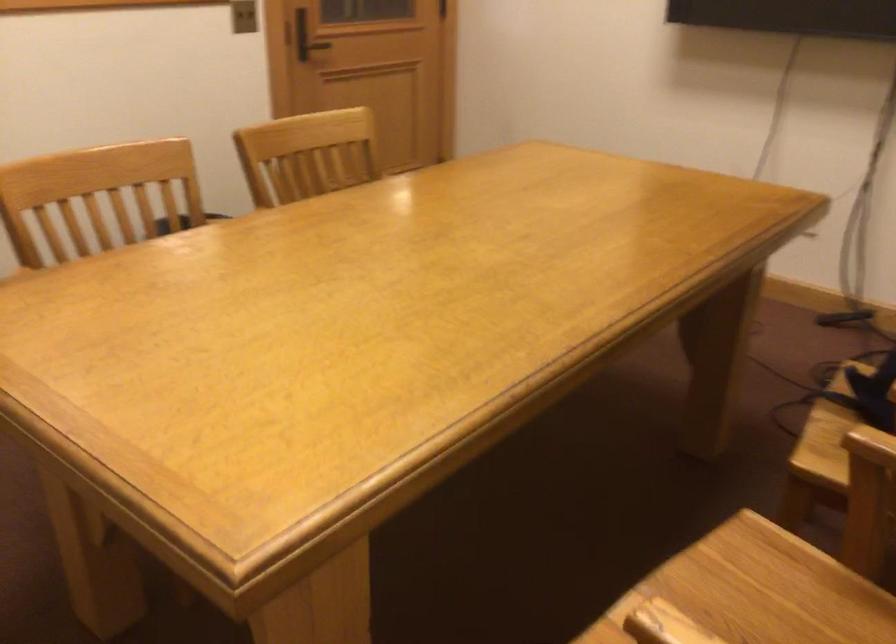
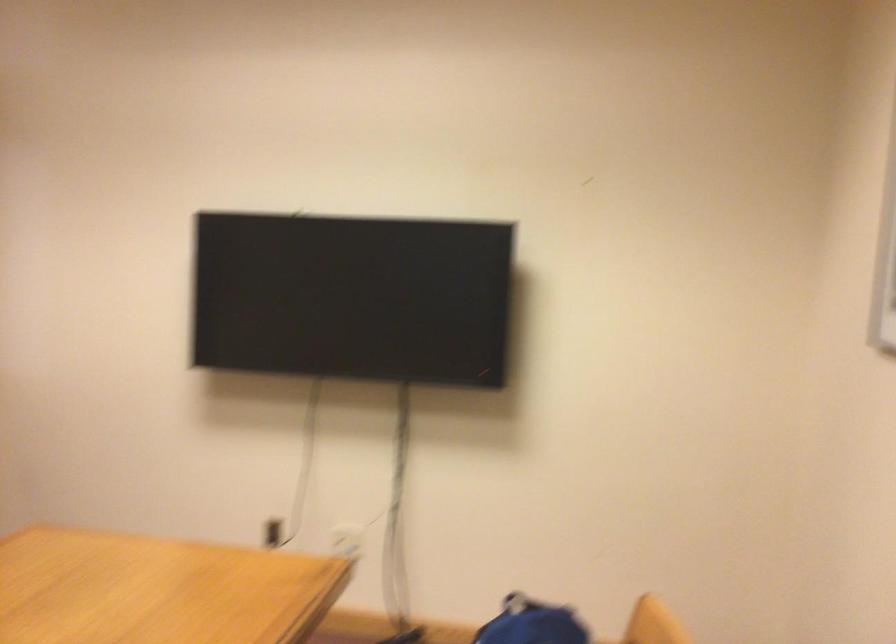
Based on the continuous images, in which direction is the camera rotating?

The camera's rotation is toward right-up.